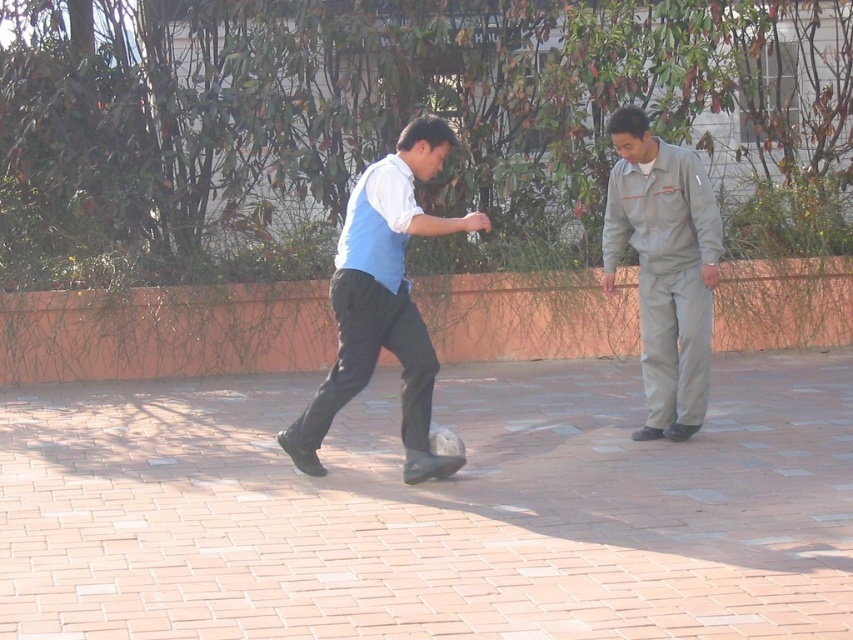
Question: Is matte blue vest at center below gray uniform at right?

Choices:
 (A) no
 (B) yes

Answer: (B)

Question: Does matte blue vest at center lie in front of gray uniform at right?

Choices:
 (A) yes
 (B) no

Answer: (A)

Question: Where is matte blue vest at center located in relation to gray uniform at right in the image?

Choices:
 (A) above
 (B) below

Answer: (B)